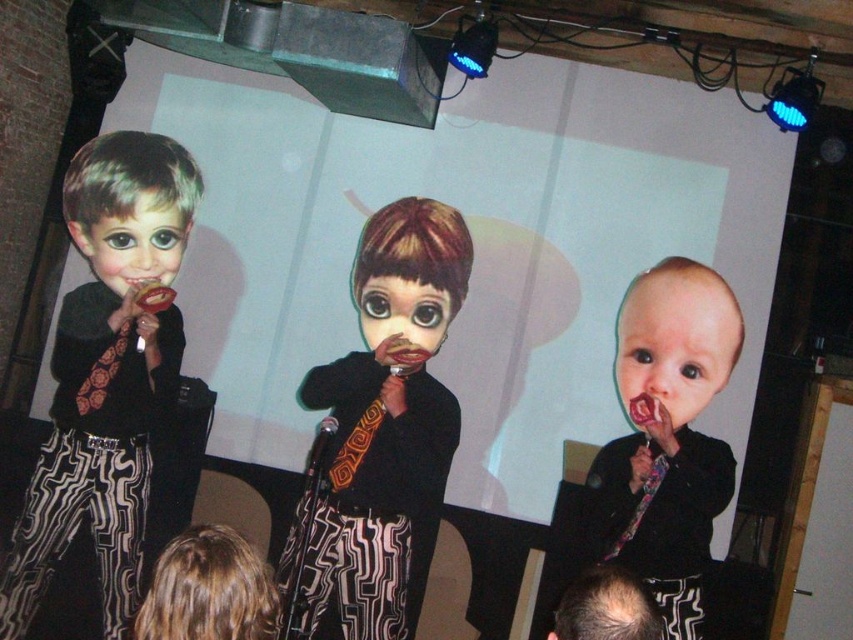
Who is shorter, matte black suit at center or smooth bald head at lower center?

With less height is smooth bald head at lower center.

Does matte black suit at center have a greater width compared to smooth bald head at lower center?

Indeed, matte black suit at center has a greater width compared to smooth bald head at lower center.

Measure the distance between point (643, 417) and camera.

3.77 meters

The image size is (853, 640). Identify the location of matte black suit at center. (665, 436).

Between point (90, 499) and point (689, 352), which one is positioned in front?

Point (90, 499) is more forward.

Is matte black suit at left taller than smooth skin baby at center?

Correct, matte black suit at left is much taller as smooth skin baby at center.

At what (x,y) coordinates should I click in order to perform the action: click on matte black suit at left. Please return your answer as a coordinate pair (x, y). The image size is (853, 640). Looking at the image, I should click on (106, 372).

Between matte black suit at center and matte black face at left, which one is positioned higher?

matte black face at left is higher up.

Who is shorter, matte black suit at center or matte black face at left?

matte black face at left

Where is `matte black suit at center`? The image size is (853, 640). matte black suit at center is located at coordinates (665, 436).